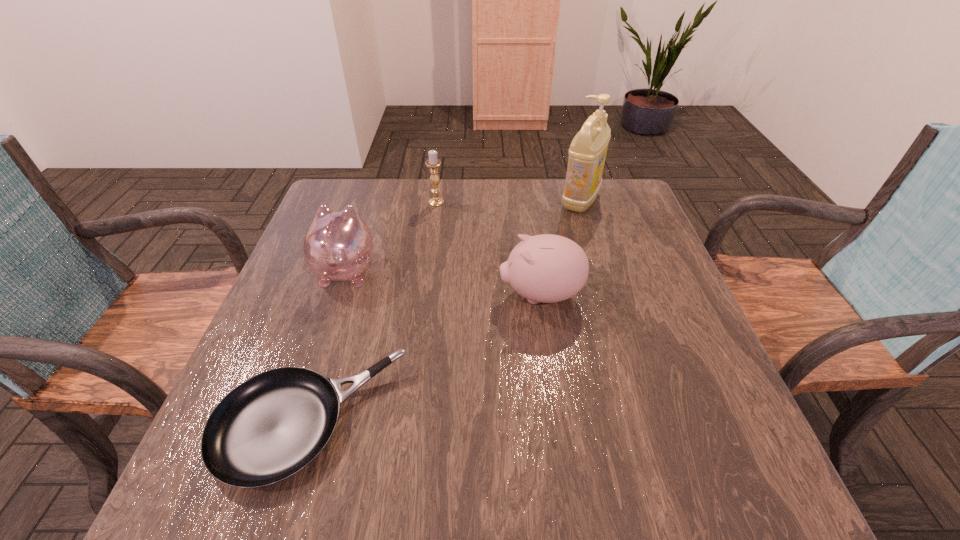
Locate an element on the screen. This screenshot has width=960, height=540. the tallest object is located at coordinates (587, 153).

Image resolution: width=960 pixels, height=540 pixels. I want to click on candle holder, so click(433, 163).

The height and width of the screenshot is (540, 960). Find the location of `the left piggy bank`. the left piggy bank is located at coordinates (338, 246).

The width and height of the screenshot is (960, 540). I want to click on the right piggy bank, so click(x=547, y=268).

Where is `pan`? pan is located at coordinates (268, 428).

Where is `the nearest object`? the nearest object is located at coordinates (268, 428).

Identify the location of free space located 0.290m on the left of the detergent. The width and height of the screenshot is (960, 540). (459, 200).

Where is `blank space located on the right of the candle holder`? The height and width of the screenshot is (540, 960). blank space located on the right of the candle holder is located at coordinates (465, 202).

Locate an element on the screen. Image resolution: width=960 pixels, height=540 pixels. free space located on the front facing side of the left piggy bank is located at coordinates (364, 215).

The height and width of the screenshot is (540, 960). Find the location of `free spot located on the front facing side of the left piggy bank`. free spot located on the front facing side of the left piggy bank is located at coordinates (375, 179).